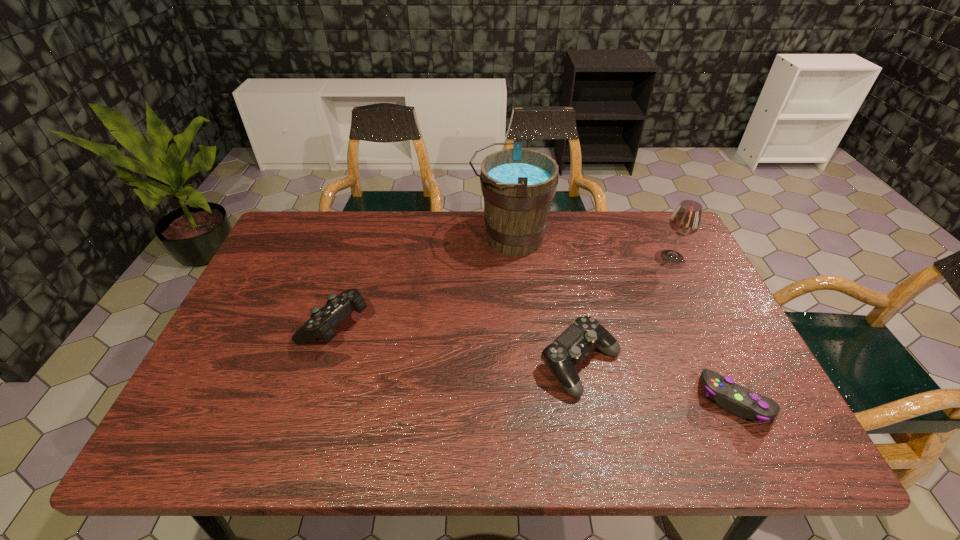
I want to click on wine bucket, so click(x=518, y=185).

At what (x,y) coordinates should I click in order to perform the action: click on the second tallest object. Please return your answer as a coordinate pair (x, y). The image size is (960, 540). Looking at the image, I should click on (686, 220).

Where is `the leftmost control`? This screenshot has height=540, width=960. the leftmost control is located at coordinates click(x=320, y=325).

The height and width of the screenshot is (540, 960). Identify the location of the second control from right to left. (567, 351).

Where is `the shortest object`? the shortest object is located at coordinates (738, 400).

Find the location of a particular element. The width and height of the screenshot is (960, 540). the rightmost control is located at coordinates (738, 400).

Find the location of `vacant space located with a handle on the side of the wine bucket`. vacant space located with a handle on the side of the wine bucket is located at coordinates (355, 239).

Find the location of `vacant space located 0.350m with a handle on the side of the wine bucket`. vacant space located 0.350m with a handle on the side of the wine bucket is located at coordinates (361, 239).

Identify the location of vacant region located with a handle on the side of the wine bucket. (396, 239).

Where is `vacant space located on the left of the second tallest object`? vacant space located on the left of the second tallest object is located at coordinates (642, 257).